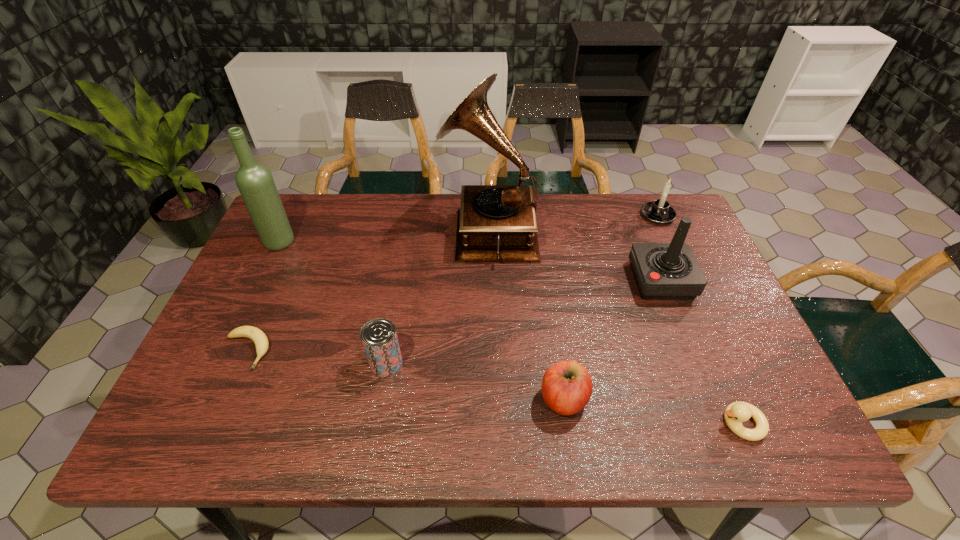
You are a GUI agent. You are given a task and a screenshot of the screen. Output one action in this format:
    pyautogui.click(x=<x>, y=<y>)
    Task: Click on the free region that satisfies the following two spatial constraints: 1. on the horn of the record player; 2. on the front side of the seventh shortest object
    The height and width of the screenshot is (540, 960).
    Given the screenshot: What is the action you would take?
    pyautogui.click(x=490, y=242)

Where is `vacant space that satisfies the following two spatial constraints: 1. on the front side of the wine bottle; 2. on the right side of the beer can`? vacant space that satisfies the following two spatial constraints: 1. on the front side of the wine bottle; 2. on the right side of the beer can is located at coordinates (223, 363).

Where is `free location that satisfies the following two spatial constraints: 1. on the front-facing side of the third tallest object; 2. on the front side of the apple`? free location that satisfies the following two spatial constraints: 1. on the front-facing side of the third tallest object; 2. on the front side of the apple is located at coordinates (708, 399).

Image resolution: width=960 pixels, height=540 pixels. Identify the location of vacant area that satisfies the following two spatial constraints: 1. on the front side of the shortest object; 2. on the right side of the apple. (225, 399).